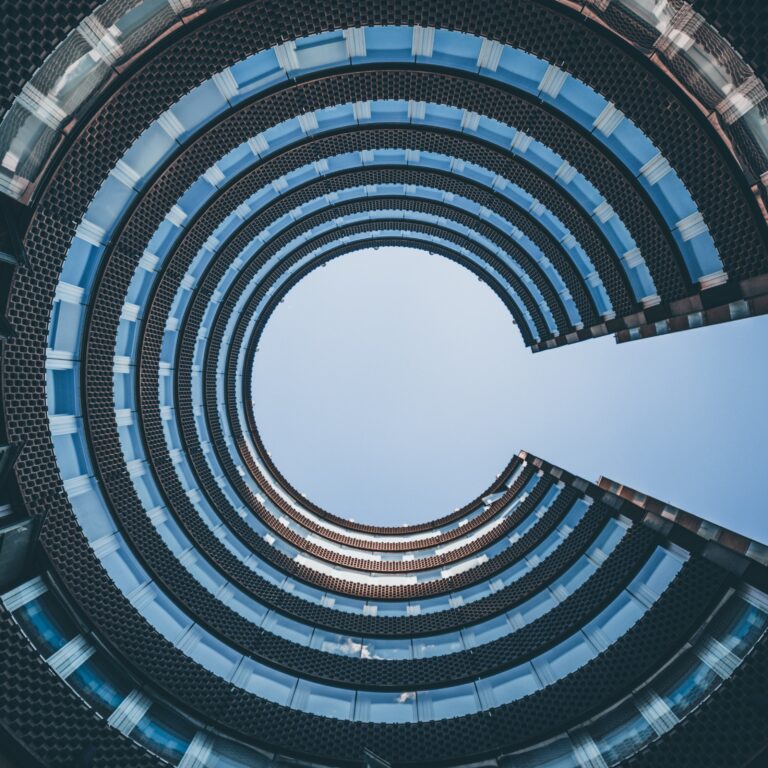
Find the location of a particular element. rows of windows is located at coordinates (71, 64), (134, 157), (197, 194), (226, 223), (247, 249), (263, 272), (276, 282).